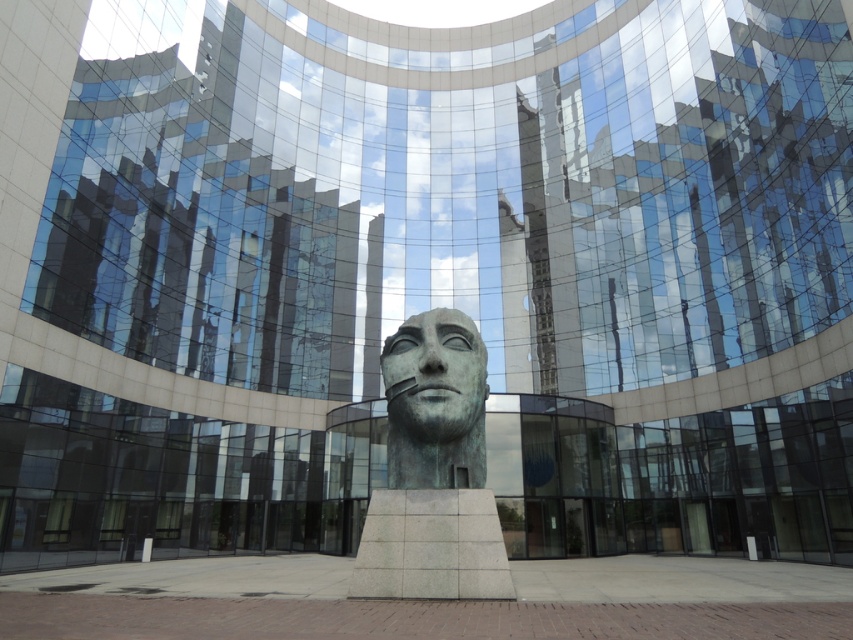
Does point (415, 595) come closer to viewer compared to point (387, 362)?

Yes.

Between point (457, 316) and point (457, 380), which one is positioned in front?

Point (457, 380) is in front.

Between point (427, 342) and point (434, 320), which one is positioned behind?

The point (434, 320) is behind.

Image resolution: width=853 pixels, height=640 pixels. I want to click on green patina bronze head at center, so point(433,472).